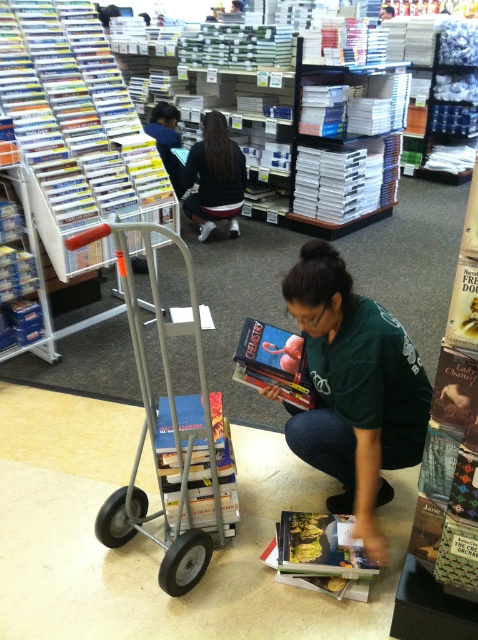
Which is behind, point (224, 200) or point (293, 333)?

Point (224, 200)

From the picture: Between dark brown hair at upper center and matte hardcover book at center, which one appears on the left side from the viewer's perspective?

dark brown hair at upper center

Between point (210, 116) and point (248, 317), which one is positioned behind?

The point (210, 116) is more distant.

The image size is (478, 640). What are the coordinates of `dark brown hair at upper center` in the screenshot? It's located at (214, 177).

Describe the element at coordinates (225, 465) in the screenshot. I see `hardcover book at center` at that location.

Is hardcover book at center bigger than matte hardcover book at center?

Correct, hardcover book at center is larger in size than matte hardcover book at center.

The width and height of the screenshot is (478, 640). What are the coordinates of `hardcover book at center` in the screenshot? It's located at (225, 465).

Between hardcover book at center and dark brown hair at upper center, which one is positioned higher?

dark brown hair at upper center

Who is more forward, (167, 410) or (228, 177)?

Point (167, 410) is in front.

This screenshot has width=478, height=640. Describe the element at coordinates (225, 465) in the screenshot. I see `hardcover book at center` at that location.

You are a GUI agent. You are given a task and a screenshot of the screen. Output one action in this format:
    pyautogui.click(x=<x>, y=<y>)
    Task: Click on the hardcover book at center
    Image resolution: width=478 pixels, height=640 pixels.
    Given the screenshot: What is the action you would take?
    pyautogui.click(x=225, y=465)